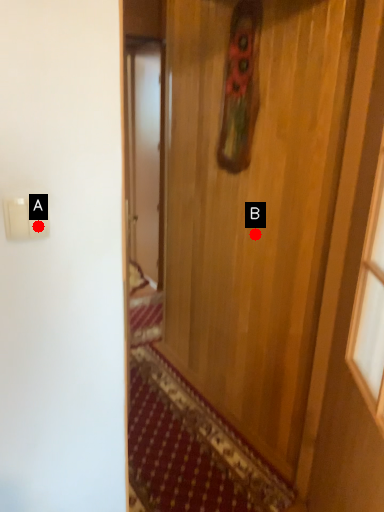
Question: Two points are circled on the image, labeled by A and B beside each circle. Which point is farther to the camera?

Choices:
 (A) A is further
 (B) B is further

Answer: (B)